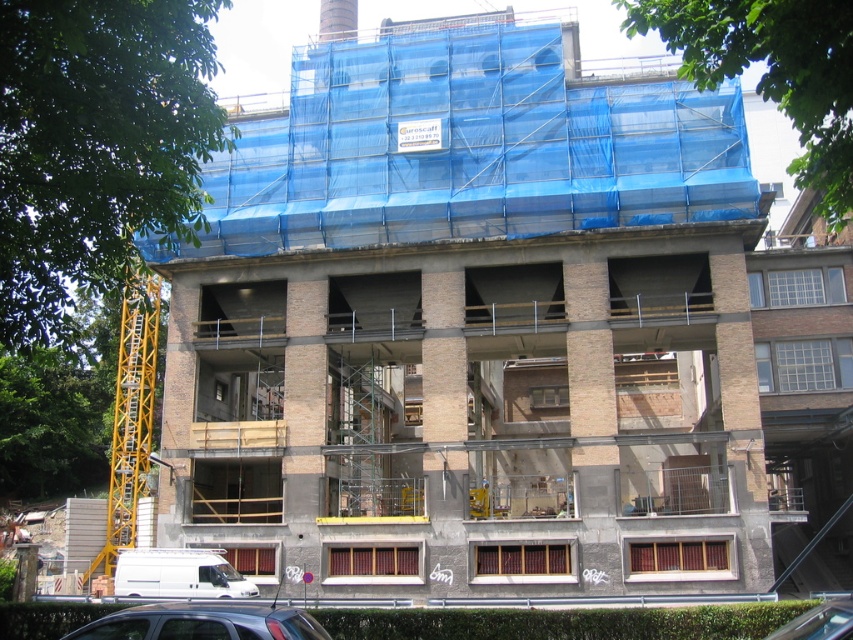
The width and height of the screenshot is (853, 640). What do you see at coordinates (202, 621) in the screenshot?
I see `matte black car at lower center` at bounding box center [202, 621].

Does matte black car at lower center have a greater height compared to metallic silver car at lower right?

Yes.

Who is more forward, (196, 637) or (833, 602)?

Point (196, 637) is in front.

This screenshot has width=853, height=640. I want to click on matte black car at lower center, so click(202, 621).

Between white matte van at lower left and metallic silver car at lower right, which one has more height?

With more height is metallic silver car at lower right.

Is white matte van at lower left taller than metallic silver car at lower right?

No, white matte van at lower left is not taller than metallic silver car at lower right.

Image resolution: width=853 pixels, height=640 pixels. I want to click on white matte van at lower left, so [x=178, y=573].

Image resolution: width=853 pixels, height=640 pixels. Identify the location of white matte van at lower left. (178, 573).

Who is lower down, matte black car at lower center or white matte van at lower left?

white matte van at lower left

Is matte black car at lower center to the left of white matte van at lower left from the viewer's perspective?

No, matte black car at lower center is not to the left of white matte van at lower left.

This screenshot has width=853, height=640. Find the location of `matte black car at lower center`. matte black car at lower center is located at coordinates (202, 621).

The image size is (853, 640). In order to click on matte black car at lower center in this screenshot , I will do `click(202, 621)`.